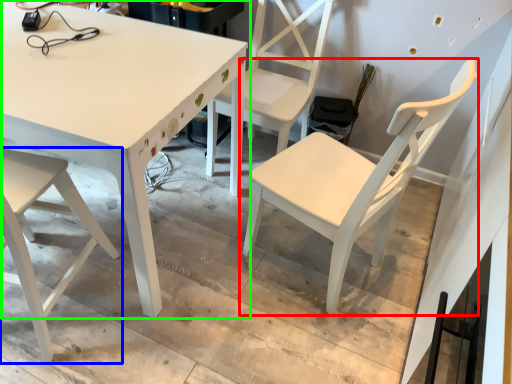
Question: Considering the real-world distances, which object is farthest from chair (highlighted by a red box)? chair (highlighted by a blue box) or table (highlighted by a green box)?

Choices:
 (A) chair
 (B) table

Answer: (A)